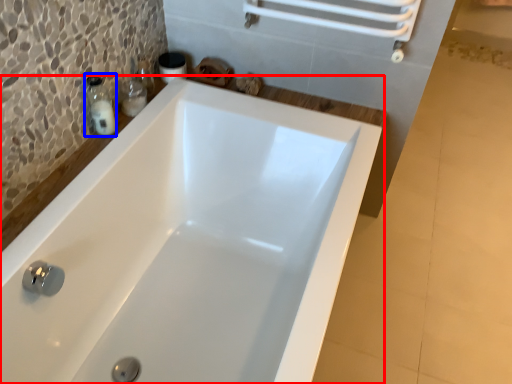
Question: Which object is further to the camera taking this photo, bathtub (highlighted by a red box) or soap dispenser (highlighted by a blue box)?

Choices:
 (A) bathtub
 (B) soap dispenser

Answer: (B)